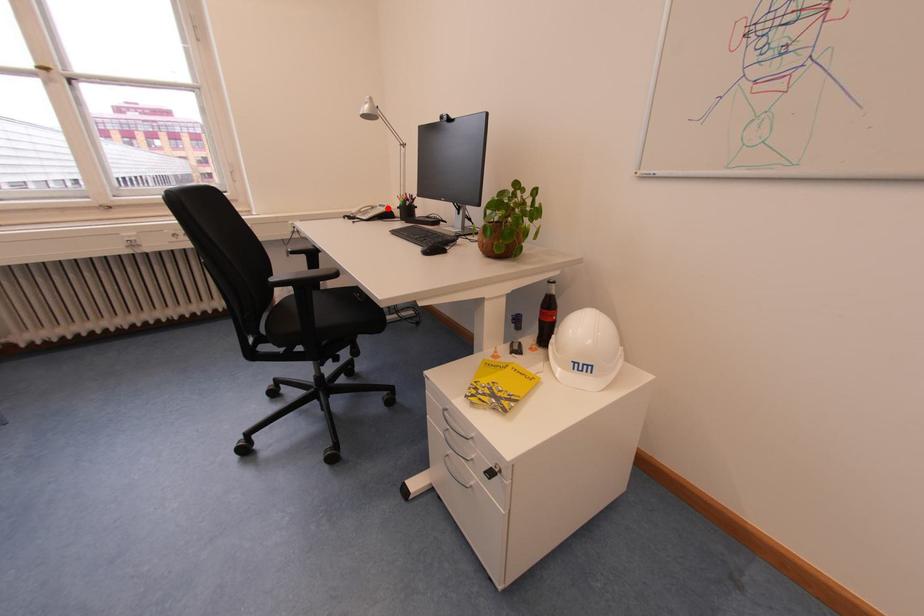
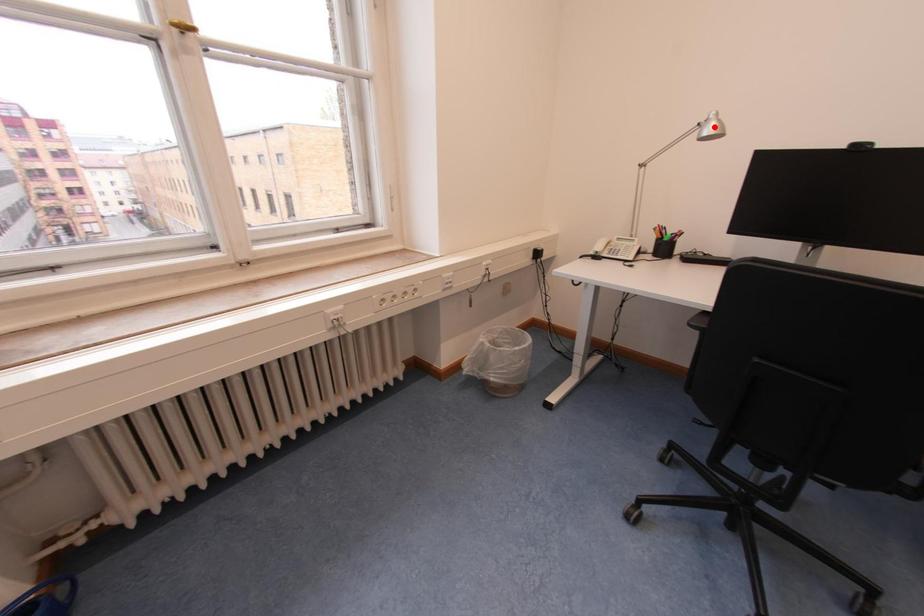
I am providing you with two images of the same scene from different viewpoints. A red point is marked on the first image and another point is marked on the second image. Is the marked point in image1 the same physical position as the marked point in image2?

No